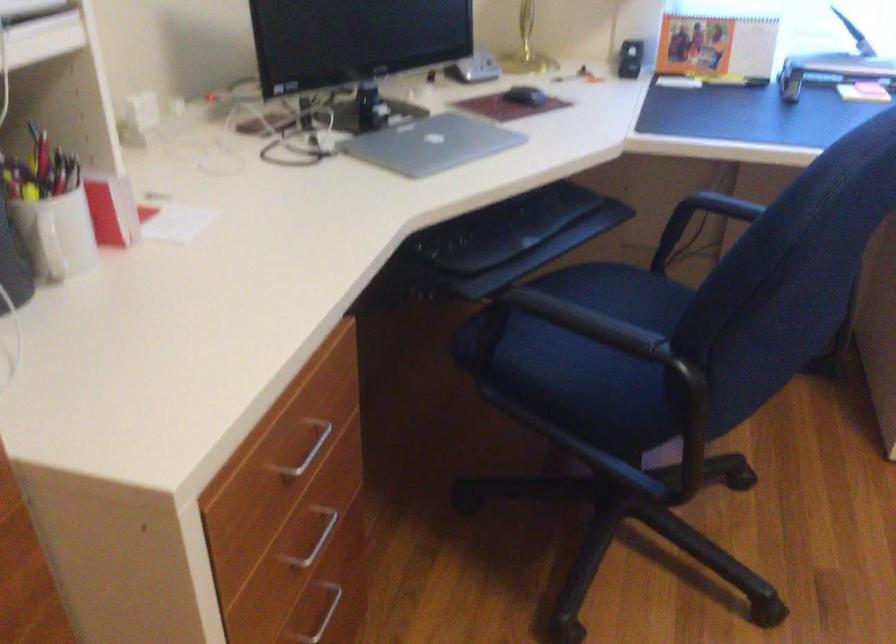
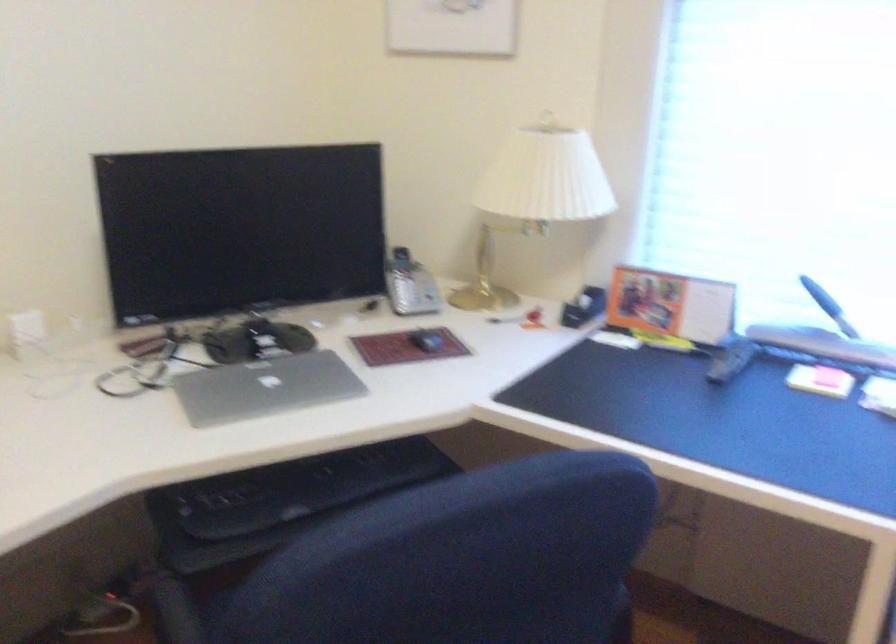
Where in the second image is the point corresponding to the point at 435,143 from the first image?

(264, 386)